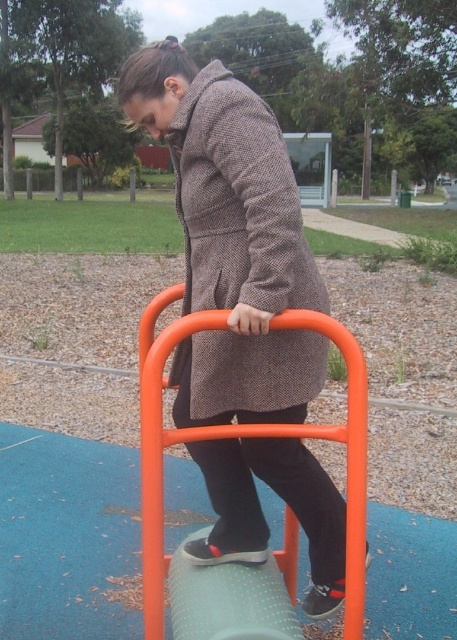
Question: Does matte brown coat at center come behind herringbone wool coat at center?

Choices:
 (A) yes
 (B) no

Answer: (A)

Question: Which point is closer to the camera?

Choices:
 (A) (186, 72)
 (B) (307, 272)

Answer: (B)

Question: Which point appears closest to the camera in this image?

Choices:
 (A) (223, 67)
 (B) (234, 186)

Answer: (B)

Question: Among these objects, which one is farthest from the camera?

Choices:
 (A) herringbone wool coat at center
 (B) matte brown coat at center

Answer: (B)

Question: Considering the relative positions of matte brown coat at center and herringbone wool coat at center in the image provided, where is matte brown coat at center located with respect to herringbone wool coat at center?

Choices:
 (A) right
 (B) left

Answer: (A)

Question: Can you confirm if matte brown coat at center is wider than herringbone wool coat at center?

Choices:
 (A) no
 (B) yes

Answer: (B)